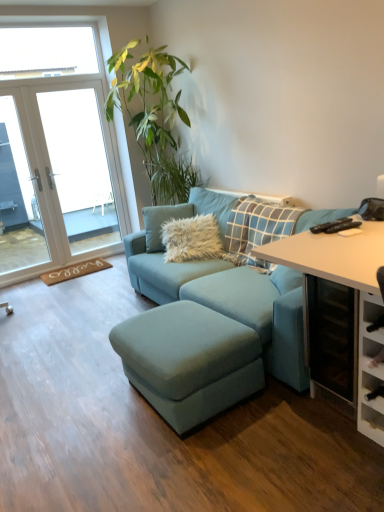
What do you see at coordinates (80, 167) in the screenshot? This screenshot has width=384, height=512. I see `white glass door at left` at bounding box center [80, 167].

What do you see at coordinates (332, 255) in the screenshot? I see `white glossy table at right` at bounding box center [332, 255].

In order to face fuzzy white pillow at center, should I rotate leftwards or rightwards?

It's best to rotate left around 0.072 degrees.

Locate an element on the screen. suede blue studio couch at center is located at coordinates (231, 301).

Is white glass door at upper left at the right side of white glass door at left?

No.

Find the location of a particular element. This screenshot has width=384, height=512. window screen lying behind the white glass door at upper left is located at coordinates (80, 167).

Which of these two, white glass door at upper left or white glass door at left, is wider?

Wider between the two is white glass door at left.

Which is correct: white glass door at upper left is inside white glass door at left, or outside of it?

white glass door at upper left is spatially positioned inside white glass door at left.

From the image's perspective, between white glossy table at right and suede blue footrest at center, who is located below?

suede blue footrest at center is shown below in the image.

Which is more to the right, white glossy table at right or suede blue footrest at center?

From the viewer's perspective, white glossy table at right appears more on the right side.

Which is behind, white glossy table at right or suede blue footrest at center?

white glossy table at right is behind.

From the image's perspective, between suede blue footrest at center and fuzzy white pillow at center, who is located below?

suede blue footrest at center.

Is suede blue footrest at center aimed at fuzzy white pillow at center?

No, suede blue footrest at center is not facing towards fuzzy white pillow at center.

Which object is more forward, suede blue footrest at center or fuzzy white pillow at center?

suede blue footrest at center is closer to the camera.

Is suede blue studio couch at center looking in the opposite direction of white glass door at left?

suede blue studio couch at center is not turned away from white glass door at left.

From the image's perspective, which one is positioned lower, suede blue studio couch at center or white glass door at left?

suede blue studio couch at center.

Does point (298, 389) come closer to viewer compared to point (71, 91)?

Yes.

The width and height of the screenshot is (384, 512). What are the coordinates of `window screen that appears on the left of suede blue studio couch at center` in the screenshot? It's located at (80, 167).

Is suede blue footrest at center outside of white glass door at upper left?

Absolutely, suede blue footrest at center is external to white glass door at upper left.

Is suede blue footrest at center bigger or smaller than white glass door at upper left?

suede blue footrest at center is smaller than white glass door at upper left.

At what (x,y) coordinates should I click in order to perform the action: click on window above the suede blue footrest at center (from a real-world perspective). Please return your answer as a coordinate pair (x, y). Looking at the image, I should click on (59, 149).

Looking at this image, which object is thinner, suede blue footrest at center or white glass door at upper left?

white glass door at upper left.

In the scene shown: Could you tell me if white glossy table at right is turned towards fuzzy white pillow at center?

No.

Considering the relative positions of white glossy table at right and fuzzy white pillow at center in the image provided, is white glossy table at right behind fuzzy white pillow at center?

No, white glossy table at right is closer to the viewer.

In terms of height, does white glossy table at right look taller or shorter compared to fuzzy white pillow at center?

Clearly, white glossy table at right is shorter compared to fuzzy white pillow at center.

In the scene shown: Is fuzzy white pillow at center wider than suede blue studio couch at center?

No.

Where is `pillow lying behind the suede blue studio couch at center`? pillow lying behind the suede blue studio couch at center is located at coordinates (194, 240).

Can you confirm if fuzzy white pillow at center is shorter than suede blue studio couch at center?

Yes.

The width and height of the screenshot is (384, 512). Identify the location of window below the white glass door at left (from the image's perspective). [x=59, y=149].

The image size is (384, 512). Identify the location of table behind the suede blue footrest at center. (332, 255).

Looking at the image, which one is located further to suede blue footrest at center, fuzzy white pillow at center or white glass door at left?

Based on the image, white glass door at left appears to be further to suede blue footrest at center.

When comparing their distances from white glossy table at right, does suede blue footrest at center or white glass door at left seem further?

Based on the image, white glass door at left appears to be further to white glossy table at right.

Consider the image. From the image, which object appears to be nearer to suede blue footrest at center, white glossy table at right or white glass door at upper left?

white glossy table at right lies closer to suede blue footrest at center than the other object.

Which object lies further to the anchor point suede blue footrest at center, white glass door at left or white glossy table at right?

Based on the image, white glass door at left appears to be further to suede blue footrest at center.

Estimate the real-world distances between objects in this image. Which object is closer to white glossy table at right, white glass door at upper left or white glass door at left?

white glass door at upper left is positioned closer to the anchor white glossy table at right.

Looking at the image, which one is located further to white glossy table at right, white glass door at left or suede blue studio couch at center?

white glass door at left.

From the image, which object appears to be nearer to white glass door at upper left, suede blue studio couch at center or fuzzy white pillow at center?

suede blue studio couch at center is positioned closer to the anchor white glass door at upper left.

Based on the photo, looking at the image, which one is located closer to white glossy table at right, suede blue studio couch at center or white glass door at upper left?

Based on the image, suede blue studio couch at center appears to be nearer to white glossy table at right.

Where is `pillow between white glass door at upper left and white glossy table at right`? This screenshot has width=384, height=512. pillow between white glass door at upper left and white glossy table at right is located at coordinates (194, 240).

The image size is (384, 512). What are the coordinates of `window between suede blue footrest at center and white glass door at left in the front-back direction` in the screenshot? It's located at (59, 149).

Where is `studio couch between suede blue footrest at center and white glass door at upper left from front to back`? The width and height of the screenshot is (384, 512). studio couch between suede blue footrest at center and white glass door at upper left from front to back is located at coordinates (231, 301).

Find the location of `pillow located between suede blue footrest at center and white glass door at upper left in the depth direction`. pillow located between suede blue footrest at center and white glass door at upper left in the depth direction is located at coordinates (194, 240).